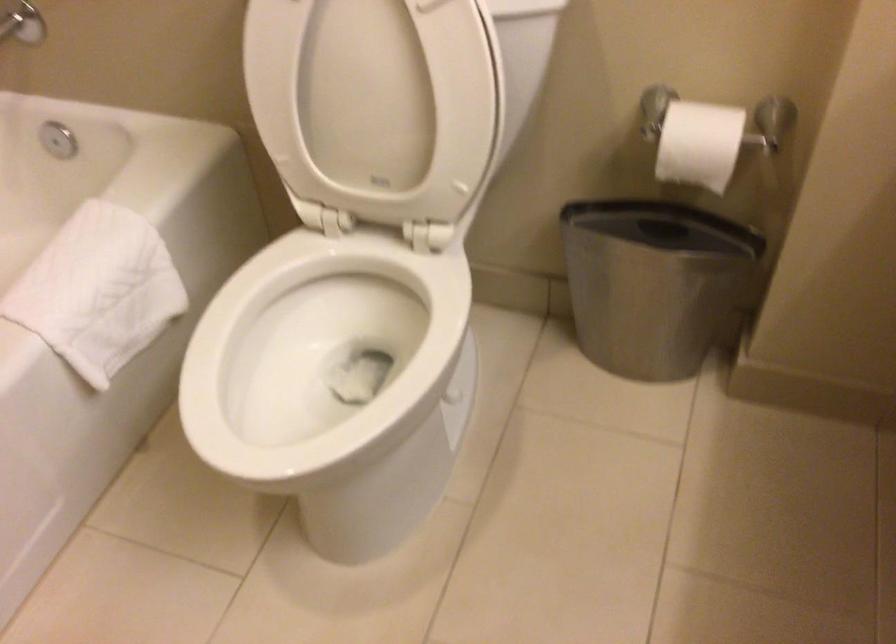
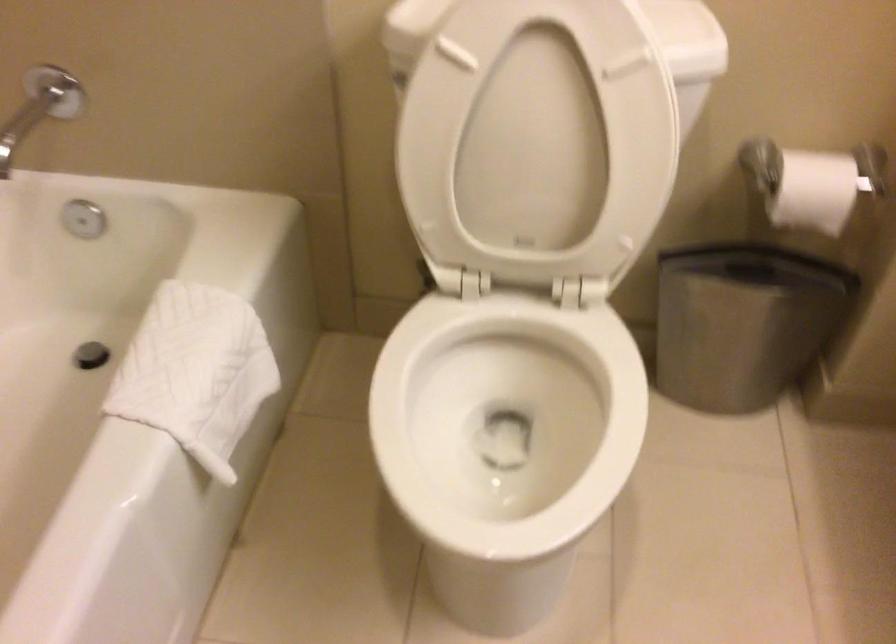
The point at (634,283) is marked in the first image. Where is the corresponding point in the second image?

(743, 323)